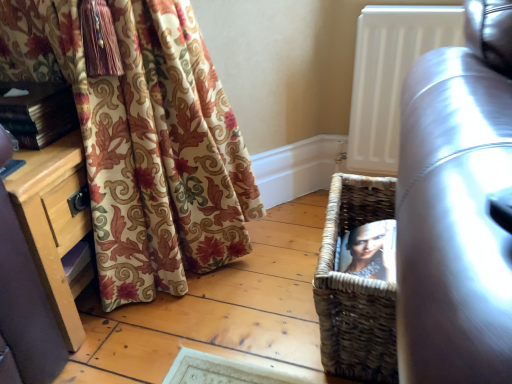
Where is `woven brown basket at lower right`? woven brown basket at lower right is located at coordinates (356, 287).

At what (x,y) coordinates should I click in order to perform the action: click on white matte radiator at upper right. Please return your answer as a coordinate pair (x, y). The image size is (512, 384). Looking at the image, I should click on (390, 75).

The height and width of the screenshot is (384, 512). I want to click on wooden dresser at lower left, so click(x=55, y=225).

Considering the sizes of objects hardcover book at left and wooden dresser at lower left in the image provided, who is shorter, hardcover book at left or wooden dresser at lower left?

hardcover book at left is shorter.

Based on their positions, is hardcover book at left located to the left or right of wooden dresser at lower left?

Clearly, hardcover book at left is on the left of wooden dresser at lower left in the image.

Between hardcover book at left and wooden dresser at lower left, which one has smaller size?

hardcover book at left is smaller.

From a real-world perspective, is hardcover book at left positioned above or below wooden dresser at lower left?

In terms of real-world spatial position, hardcover book at left is above wooden dresser at lower left.

Consider the image. Is wooden dresser at lower left outside of leather couch at right?

wooden dresser at lower left is positioned outside leather couch at right.

Considering the sizes of objects wooden dresser at lower left and leather couch at right in the image provided, who is smaller, wooden dresser at lower left or leather couch at right?

wooden dresser at lower left is smaller.

Which is behind, point (27, 155) or point (479, 24)?

The point (27, 155) is more distant.

From the image's perspective, is wooden dresser at lower left located above or below leather couch at right?

wooden dresser at lower left is above leather couch at right.

In the image, there is a wooden dresser at lower left. Where is `basket below it (from the image's perspective)`? The height and width of the screenshot is (384, 512). basket below it (from the image's perspective) is located at coordinates (356, 287).

Would you say woven brown basket at lower right is a long distance from wooden dresser at lower left?

woven brown basket at lower right is actually quite close to wooden dresser at lower left.

Which of these two, wooden dresser at lower left or woven brown basket at lower right, stands taller?

wooden dresser at lower left is taller.

Who is bigger, wooden dresser at lower left or woven brown basket at lower right?

wooden dresser at lower left.

Does wooden dresser at lower left have a lesser width compared to woven brown basket at lower right?

Correct, the width of wooden dresser at lower left is less than that of woven brown basket at lower right.

From a real-world perspective, is wooden dresser at lower left positioned above or below woven brown basket at lower right?

In terms of real-world spatial position, wooden dresser at lower left is above woven brown basket at lower right.

How different are the orientations of wooden dresser at lower left and white matte radiator at upper right in degrees?

There is a 91.7-degree angle between the facing directions of wooden dresser at lower left and white matte radiator at upper right.

Based on the photo, are wooden dresser at lower left and white matte radiator at upper right far apart?

No.

From a real-world perspective, which is physically above, wooden dresser at lower left or white matte radiator at upper right?

white matte radiator at upper right is physically above.

Who is smaller, wooden dresser at lower left or white matte radiator at upper right?

Smaller between the two is white matte radiator at upper right.

Is point (22, 126) farther from camera compared to point (329, 287)?

Yes, it is behind point (329, 287).

Find the location of a particular element. Image resolution: width=512 pixels, height=384 pixels. basket that appears in front of the hardcover book at left is located at coordinates (356, 287).

Measure the distance between hardcover book at left and woven brown basket at lower right.

The distance of hardcover book at left from woven brown basket at lower right is 29.58 inches.

Between woven brown basket at lower right and white matte radiator at upper right, which one appears on the right side from the viewer's perspective?

From the viewer's perspective, white matte radiator at upper right appears more on the right side.

Does woven brown basket at lower right have a larger size compared to white matte radiator at upper right?

Yes, woven brown basket at lower right is bigger than white matte radiator at upper right.

Which is in front, point (373, 192) or point (384, 20)?

Point (373, 192)

Is woven brown basket at lower right positioned behind white matte radiator at upper right?

No, woven brown basket at lower right is closer to the camera.

You are a GUI agent. You are given a task and a screenshot of the screen. Output one action in this format:
    pyautogui.click(x=<x>, y=<y>)
    Task: Click on the dresser that appears in front of the hardcover book at left
    
    Given the screenshot: What is the action you would take?
    pyautogui.click(x=55, y=225)

Locate an element on the screen. The height and width of the screenshot is (384, 512). dresser below the leather couch at right (from a real-world perspective) is located at coordinates (55, 225).

Based on their spatial positions, is wooden dresser at lower left or leather couch at right further from hardcover book at left?

Among the two, leather couch at right is located further to hardcover book at left.

When comparing their distances from white matte radiator at upper right, does leather couch at right or woven brown basket at lower right seem further?

leather couch at right is further to white matte radiator at upper right.

From the image, which object appears to be farther from hardcover book at left, white matte radiator at upper right or woven brown basket at lower right?

Among the two, white matte radiator at upper right is located further to hardcover book at left.

Looking at the image, which one is located further to wooden dresser at lower left, leather couch at right or hardcover book at left?

leather couch at right is further to wooden dresser at lower left.

Considering their positions, is white matte radiator at upper right positioned further to wooden dresser at lower left than hardcover book at left?

The object further to wooden dresser at lower left is white matte radiator at upper right.

Considering their positions, is white matte radiator at upper right positioned further to hardcover book at left than wooden dresser at lower left?

white matte radiator at upper right is further to hardcover book at left.

Based on their spatial positions, is white matte radiator at upper right or leather couch at right further from wooden dresser at lower left?

white matte radiator at upper right is further to wooden dresser at lower left.

Which object lies nearer to the anchor point white matte radiator at upper right, hardcover book at left or leather couch at right?

leather couch at right is closer to white matte radiator at upper right.

You are a GUI agent. You are given a task and a screenshot of the screen. Output one action in this format:
    pyautogui.click(x=<x>, y=<y>)
    Task: Click on the dresser between hardcover book at left and woven brown basket at lower right in the horizontal direction
    This screenshot has height=384, width=512.
    Given the screenshot: What is the action you would take?
    pyautogui.click(x=55, y=225)

The image size is (512, 384). In order to click on basket between leather couch at right and white matte radiator at upper right from front to back in this screenshot , I will do `click(356, 287)`.

This screenshot has width=512, height=384. In order to click on dresser located between hardcover book at left and leather couch at right in the left-right direction in this screenshot , I will do `click(55, 225)`.

You are a GUI agent. You are given a task and a screenshot of the screen. Output one action in this format:
    pyautogui.click(x=<x>, y=<y>)
    Task: Click on the book between leather couch at right and white matte radiator at upper right in the front-back direction
    Image resolution: width=512 pixels, height=384 pixels.
    Given the screenshot: What is the action you would take?
    pyautogui.click(x=38, y=112)